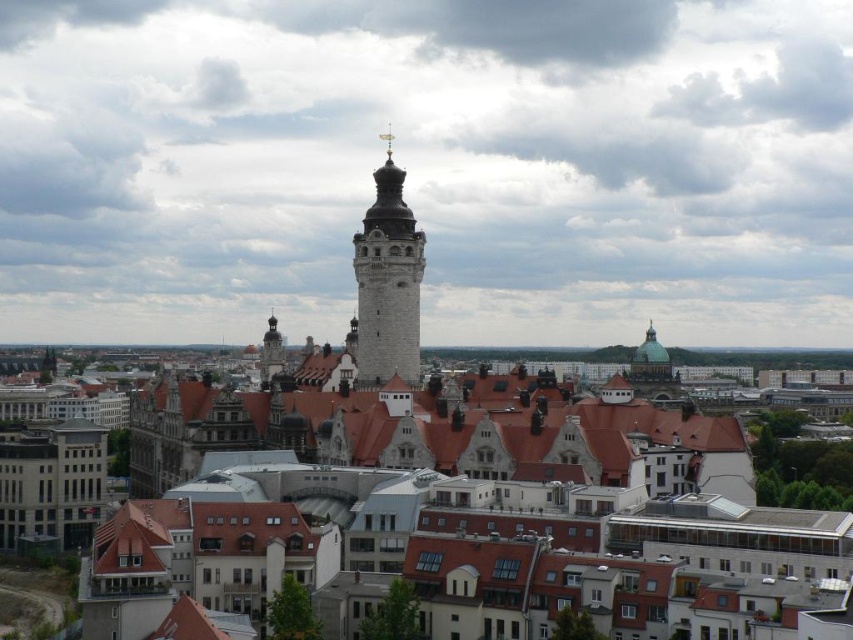
You are standing at the entrance of the city and want to reach the matte stone tower at center. According to the map, the tower is marked at coordinates point 0.673, 0.532. If you move straight ahead from your current position, will you be heading directly towards the tower?

The matte stone tower at center is located at point (453, 429), so moving straight ahead from your current position would indeed head you directly towards the tower.

You are an architect analyzing the cityscape. You notice two towers at the center of the image. Which tower is taller? The options are the matte stone tower at center and the white stone tower at center.

The white stone tower at center is taller than the matte stone tower at center.

You are standing in the cityscape described. There is a point marked at coordinates (453, 429). What structure is located at that point?

The point at coordinates (453, 429) indicates the location of the matte stone tower at center.